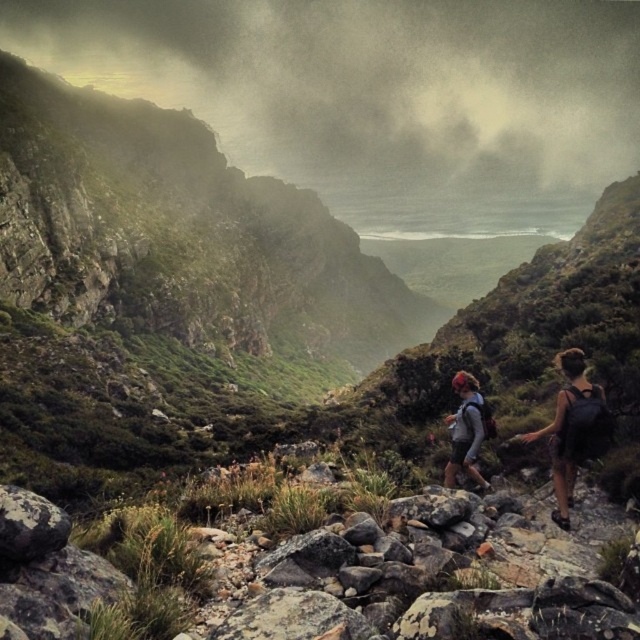
You are a hiker planning to navigate the rocky path in the rugged mountain landscape. There are two points marked on your map at coordinates point (28,541) and point (456,374). Which point should you prioritize visiting first if you want to reach the closest one to your current position?

You should prioritize visiting point (28,541) first because it is closer to the viewer than point (456,374) according to the description.

You are a hiker planning to carry both the matte gray backpack at center and the matte gray jacket at center during your mountain hike. Given their sizes, which item would you prioritize placing in an easily accessible spot for quick access?

The matte gray jacket at center is smaller in size compared to the matte gray backpack at center, so you should prioritize placing the matte gray jacket at center in an easily accessible spot for quick access.